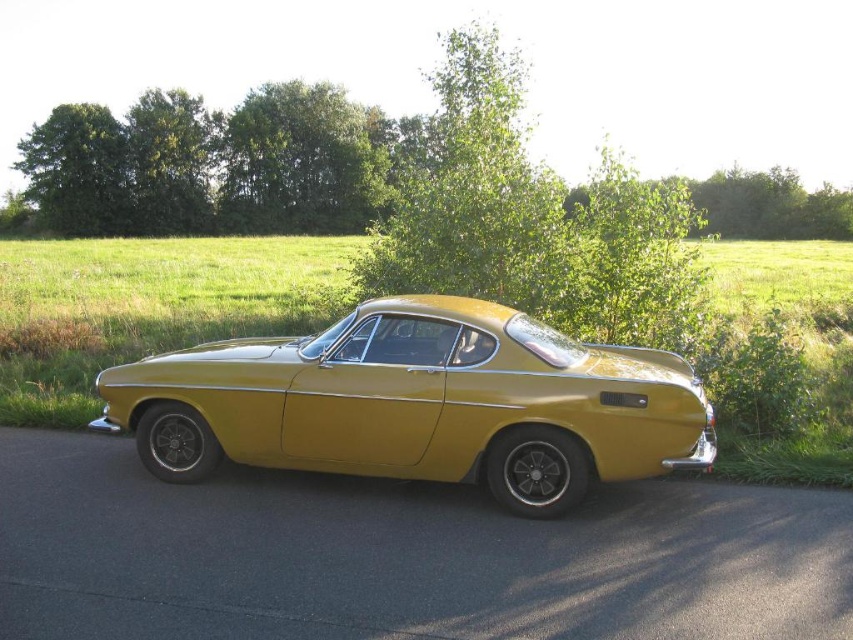
You are a delivery person carrying a package that requires a 5 meter clearance to be safely placed on the ground. You are standing in front of the metallic gold car at center. Can you safely place the package on the ground in front of the car?

The metallic gold car at center and viewer are 4.70 meters apart from each other. Since the required clearance is 5 meters, the distance is insufficient. Therefore, you cannot safely place the package on the ground in front of the car.